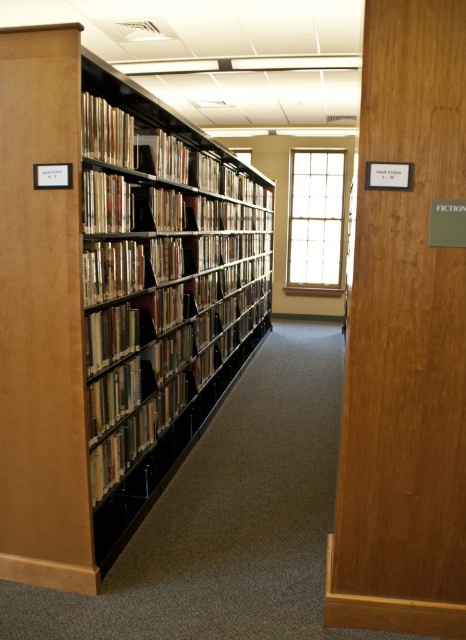
In the scene shown: You are a librarian trying to place a new hardcover book at center onto the black metal bookshelf at left. Considering the space available, will the book fit on the shelf?

The black metal bookshelf at left is wider than the hardcover book at center, so the book will fit on the shelf.

Based on the photo, you are a librarian who needs to retrieve a book located at the center of the image. However, there is a black metal bookshelf at left blocking your path. Can you walk around it to reach the hardcover book at center?

The black metal bookshelf at left is in front of the hardcover book at center, meaning the bookshelf is closer to you than the book. You can walk around the sides of the bookshelf to reach the hardcover book at center.